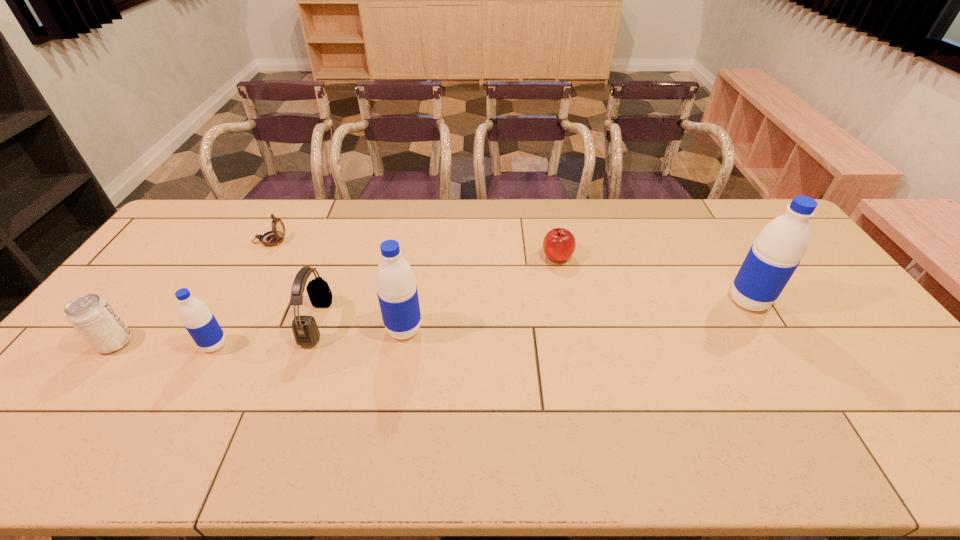
The image size is (960, 540). I want to click on spot to insert another water_bottle for uniform distribution, so click(582, 315).